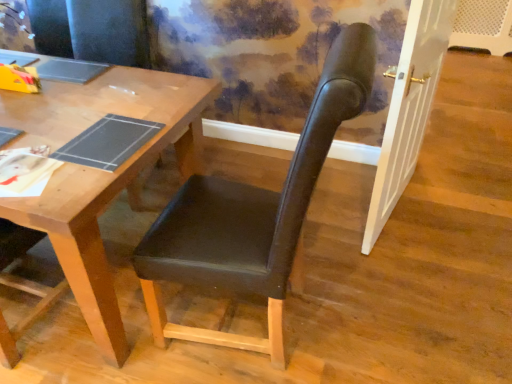
You are a GUI agent. You are given a task and a screenshot of the screen. Output one action in this format:
    pyautogui.click(x=<x>, y=<y>)
    Task: Click on the vacant space in black leather chair at center (from a real-world perspective)
    Image resolution: width=512 pixels, height=384 pixels.
    Given the screenshot: What is the action you would take?
    pyautogui.click(x=285, y=333)